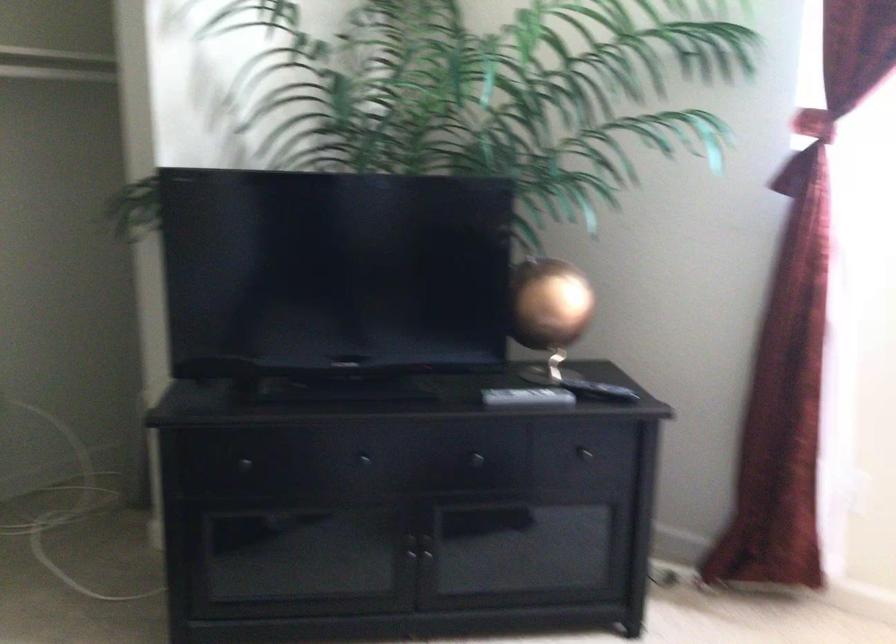
This screenshot has width=896, height=644. I want to click on black remote control, so click(x=607, y=391).